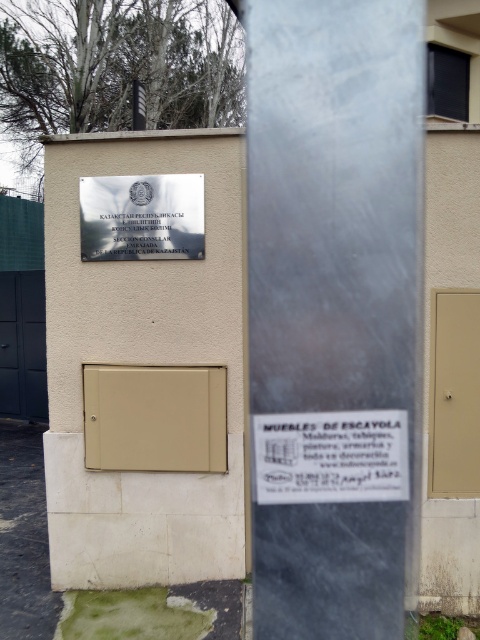
Question: Which object appears closest to the camera in this image?

Choices:
 (A) metallic silver sign at upper center
 (B) white paper sign at center

Answer: (B)

Question: Is beige matte door at center closer to the viewer compared to white paper sign at center?

Choices:
 (A) no
 (B) yes

Answer: (A)

Question: Is beige matte door at center positioned behind white paper sign at center?

Choices:
 (A) no
 (B) yes

Answer: (B)

Question: Among these points, which one is farthest from the camera?

Choices:
 (A) (x=274, y=490)
 (B) (x=95, y=232)
 (C) (x=162, y=442)

Answer: (B)

Question: Which of the following is the farthest from the observer?

Choices:
 (A) white paper sign at center
 (B) beige matte door at center

Answer: (B)

Question: Does white paper sign at center have a lesser width compared to metallic silver sign at upper center?

Choices:
 (A) no
 (B) yes

Answer: (B)